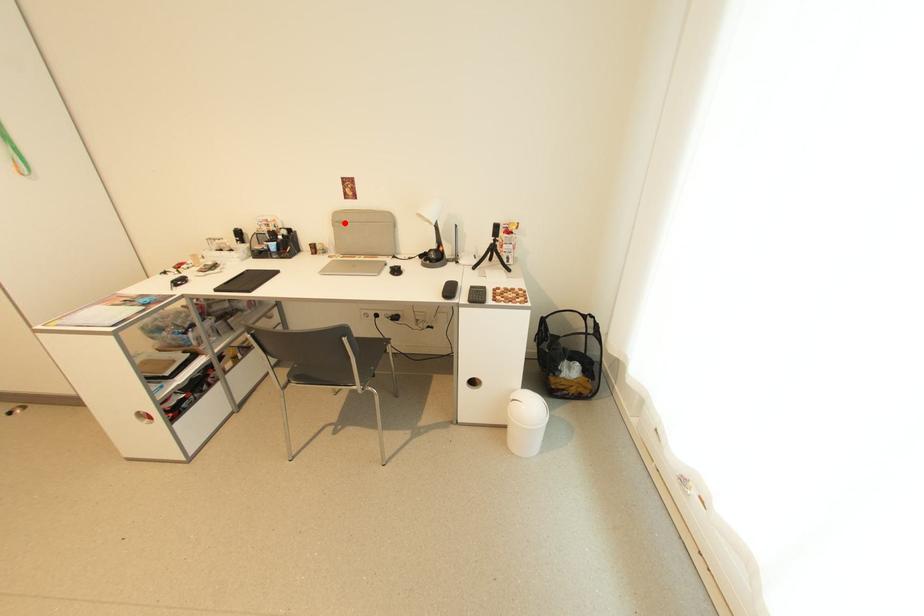
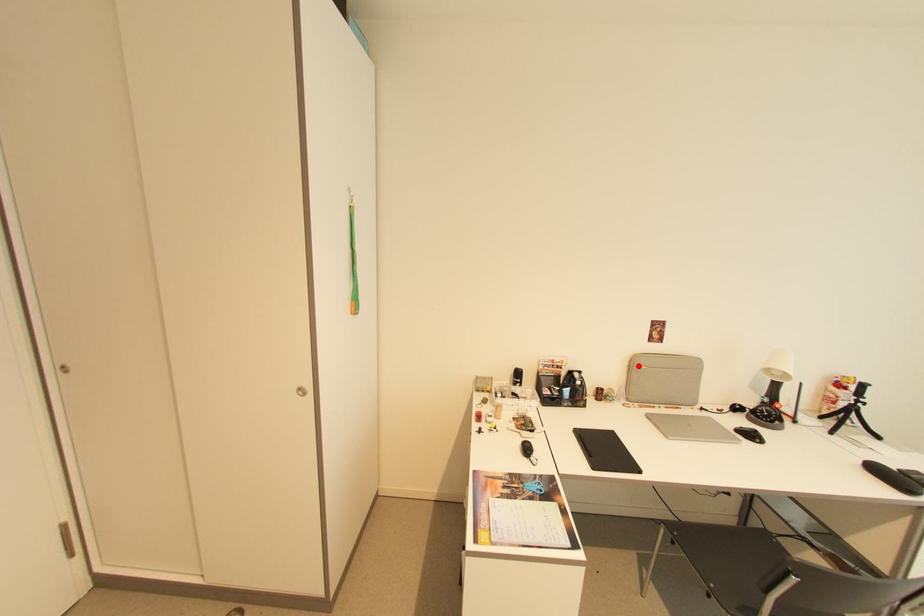
I am providing you with two images of the same scene from different viewpoints. A red point is marked on the first image and another point is marked on the second image. Does the point marked in image1 correspond to the same location as the one in image2?

Yes